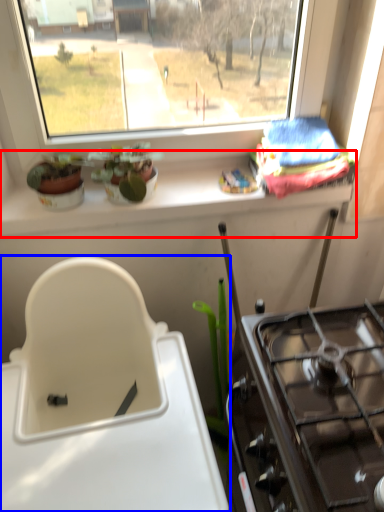
Question: Which of the following is the farthest to the observer, window sill (highlighted by a red box) or sink (highlighted by a blue box)?

Choices:
 (A) window sill
 (B) sink

Answer: (A)